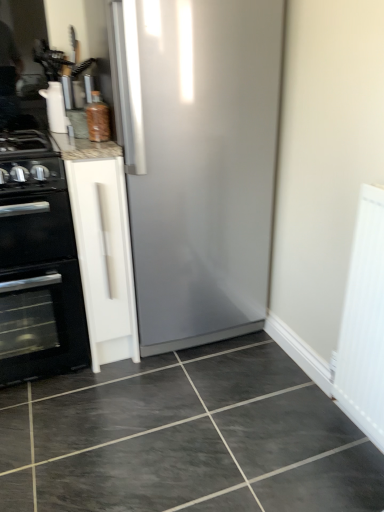
Question: From the image's perspective, is white matte cabinet at left above white textured radiator at right?

Choices:
 (A) no
 (B) yes

Answer: (B)

Question: Could white textured radiator at right be considered to be inside white matte cabinet at left?

Choices:
 (A) no
 (B) yes

Answer: (A)

Question: Is white matte cabinet at left oriented towards white textured radiator at right?

Choices:
 (A) yes
 (B) no

Answer: (B)

Question: Is the position of white matte cabinet at left more distant than that of white textured radiator at right?

Choices:
 (A) no
 (B) yes

Answer: (B)

Question: Does white matte cabinet at left have a greater width compared to white textured radiator at right?

Choices:
 (A) no
 (B) yes

Answer: (B)

Question: Considering their positions, is white matte cabinet at left located in front of or behind dark gray glossy tile at center?

Choices:
 (A) behind
 (B) front

Answer: (A)

Question: Considering the positions of white matte cabinet at left and dark gray glossy tile at center in the image, is white matte cabinet at left wider or thinner than dark gray glossy tile at center?

Choices:
 (A) thin
 (B) wide

Answer: (A)

Question: Considering the positions of white matte cabinet at left and dark gray glossy tile at center in the image, is white matte cabinet at left taller or shorter than dark gray glossy tile at center?

Choices:
 (A) tall
 (B) short

Answer: (A)

Question: Does point [77, 148] appear closer or farther from the camera than point [1, 458]?

Choices:
 (A) closer
 (B) farther

Answer: (B)

Question: In the image, is white textured radiator at right positioned in front of or behind white matte cabinet at left?

Choices:
 (A) front
 (B) behind

Answer: (A)

Question: Is white textured radiator at right wider or thinner than white matte cabinet at left?

Choices:
 (A) wide
 (B) thin

Answer: (B)

Question: From a real-world perspective, relative to white matte cabinet at left, is white textured radiator at right vertically above or below?

Choices:
 (A) above
 (B) below

Answer: (A)

Question: From the image's perspective, is white textured radiator at right positioned above or below white matte cabinet at left?

Choices:
 (A) below
 (B) above

Answer: (A)

Question: Considering the positions of white glossy paper towel dispenser at upper left and black matte gas stove at left in the image, is white glossy paper towel dispenser at upper left bigger or smaller than black matte gas stove at left?

Choices:
 (A) big
 (B) small

Answer: (B)

Question: Looking at their shapes, would you say white glossy paper towel dispenser at upper left is wider or thinner than black matte gas stove at left?

Choices:
 (A) thin
 (B) wide

Answer: (A)